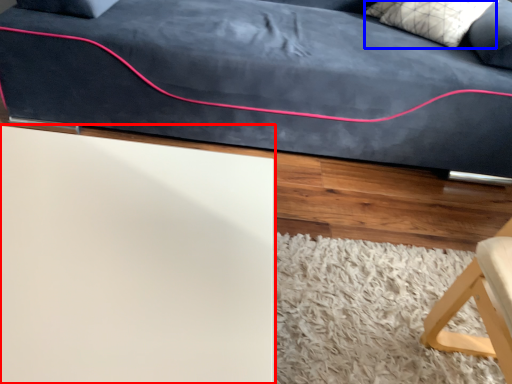
Question: Which of the following is the farthest to the observer, table (highlighted by a red box) or pillow (highlighted by a blue box)?

Choices:
 (A) table
 (B) pillow

Answer: (B)